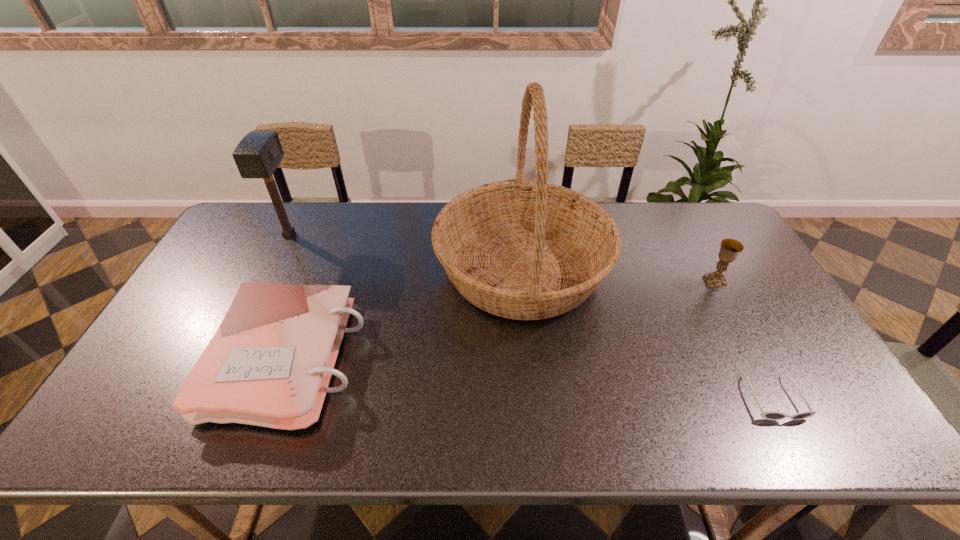
Find the location of a particular element. This screenshot has width=960, height=540. the third closest object to the phonebook is located at coordinates (769, 415).

Locate which object is the second closest to the tallest object. Please provide its 2D coordinates. Your answer should be formatted as a tuple, i.e. [(x, y)], where the tuple contains the x and y coordinates of a point satisfying the conditions above.

[(769, 415)]